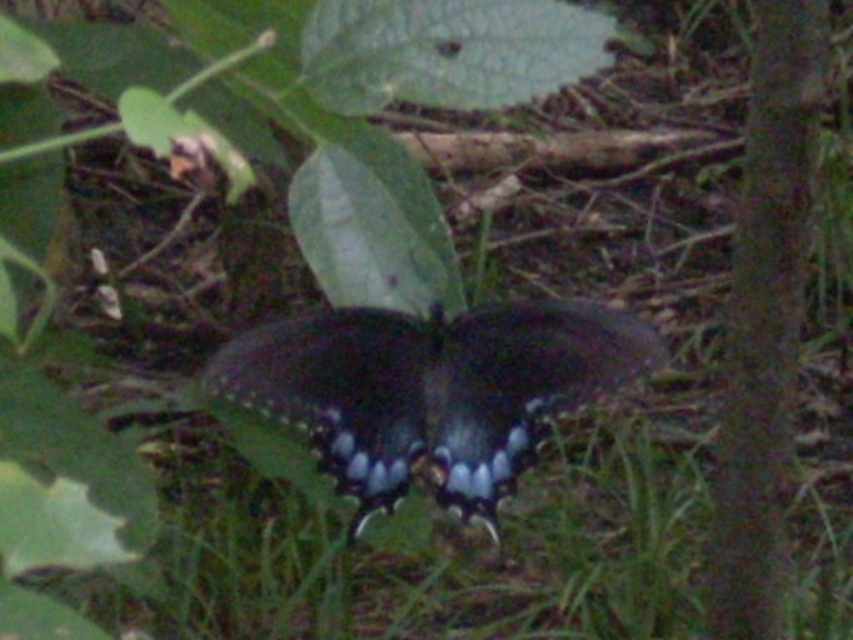
You are standing in a garden and see a butterfly with dark wings and blue spots resting on a leafy surface. There is a point at coordinates point (425, 554). Where is this point located in the garden?

The point (425, 554) is on green grass at lower center.

You are a photographer aiming to capture the butterfly on the leafy surface. To ensure the green grass at lower center is in the frame, where should you position your camera relative to the butterfly?

The green grass at lower center is located at point (x=425, y=554), so you should position your camera to include that coordinate in the frame to capture the grass along with the butterfly.

You are a nature photographer trying to capture a closeup of the shiny blue butterfly at center and the smooth bark tree at right. Based on their sizes, which one should you focus on to ensure both fit in the frame without cropping?

The shiny blue butterfly at center might be wider than smooth bark tree at right, so focusing on the butterfly would ensure both fit in the frame since it requires more width.